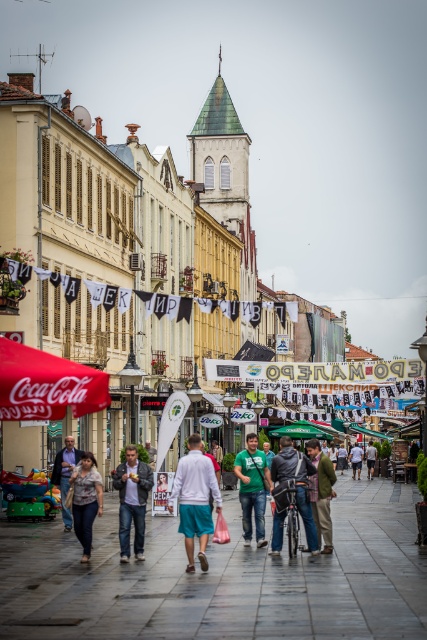
Can you confirm if denim jacket at lower left is taller than light brown leather jacket at center?

Incorrect, denim jacket at lower left's height is not larger of light brown leather jacket at center's.

Which is in front, point (79, 477) or point (66, 458)?

Point (79, 477) is in front.

Image resolution: width=427 pixels, height=640 pixels. I want to click on denim jacket at lower left, so click(85, 499).

Based on the photo, is denim jacket at center wider than green fabric jacket at center?

No, denim jacket at center is not wider than green fabric jacket at center.

Does denim jacket at center have a lesser width compared to green fabric jacket at center?

Yes, denim jacket at center is thinner than green fabric jacket at center.

Does point (134, 506) come farther from viewer compared to point (321, 497)?

That is False.

Where is `denim jacket at center`? denim jacket at center is located at coordinates (131, 500).

Is point (262, 499) more distant than point (78, 451)?

No, (262, 499) is in front of (78, 451).

Can you confirm if green matte shirt at center is shorter than light brown leather jacket at center?

No.

Image resolution: width=427 pixels, height=640 pixels. What do you see at coordinates (253, 488) in the screenshot?
I see `green matte shirt at center` at bounding box center [253, 488].

Identify the location of green matte shirt at center. (253, 488).